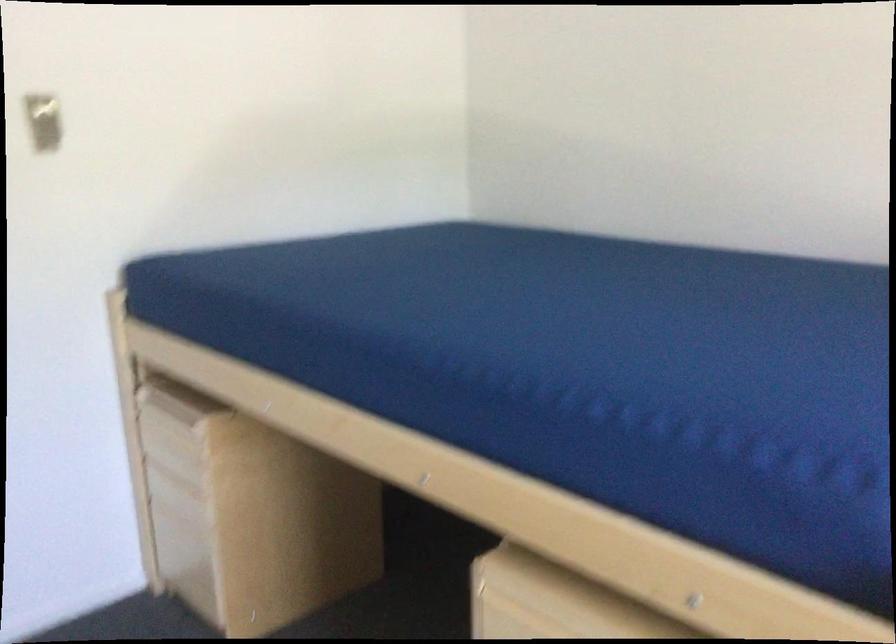
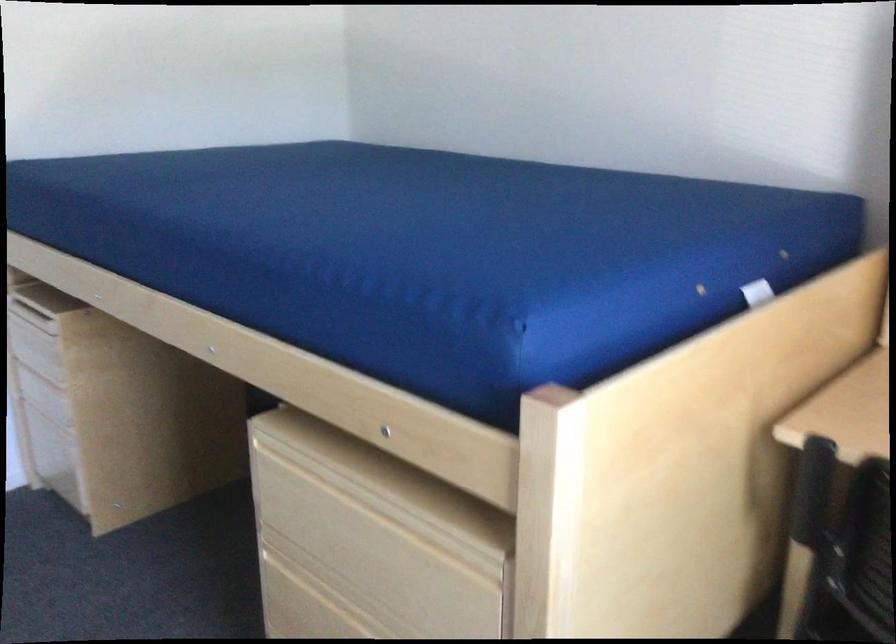
The point at (x=143, y=494) is marked in the first image. Where is the corresponding point in the second image?

(19, 395)